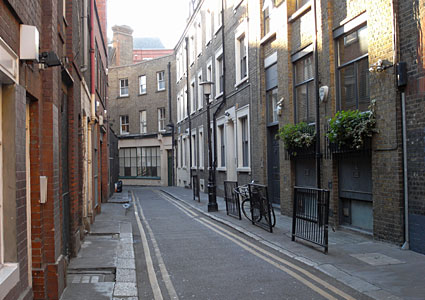
This screenshot has height=300, width=425. Identify the location of white boxes on left wall. (28, 43), (43, 188).